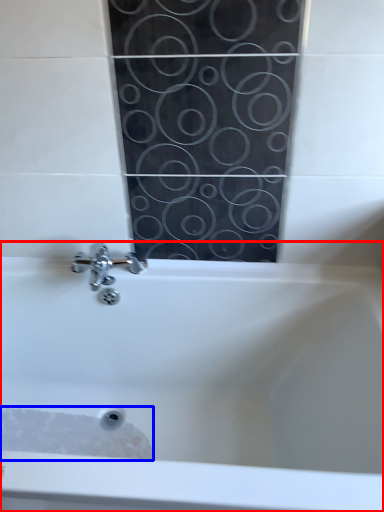
Question: Which point is further to the camera, bathtub (highlighted by a red box) or foam (highlighted by a blue box)?

Choices:
 (A) bathtub
 (B) foam

Answer: (B)